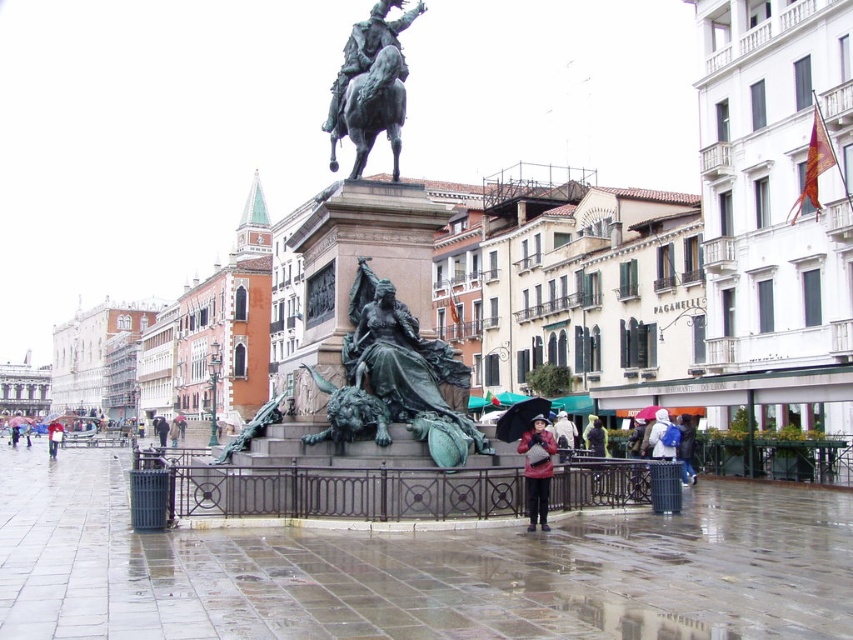
You are standing in the square and see a person wearing a red jacket at lower left and holding a black matte umbrella at center. Which object is closer to the left side of the square?

The red jacket at lower left is closer to the left side of the square since it is positioned to the left of the black matte umbrella at center.

You are standing in the square and want to walk from the red jacket at lower left to the black matte umbrella at center. Which direction should you move to get closer to the umbrella?

To move closer to the black matte umbrella at center from the red jacket at lower left, you should walk towards the center of the square since the umbrella is further away from the viewer compared to the jacket.

From the picture: You are standing in the square and want to retrieve both the black matte umbrella at lower center and the raincoat matte at lower left. Which item should you move towards first if you are currently positioned to the right of both objects?

You should move towards the raincoat matte at lower left first because it is to the left of the black matte umbrella at lower center, so it is closer to your current position on the right side.